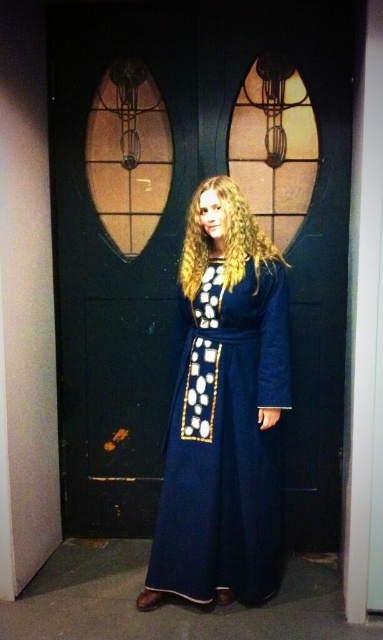
Question: Considering the real-world distances, which object is closest to the dark wood door at center?

Choices:
 (A) velvet blue robe at center
 (B) golden curly hair at center

Answer: (A)

Question: Can you confirm if dark wood door at center is smaller than velvet blue robe at center?

Choices:
 (A) yes
 (B) no

Answer: (B)

Question: Which point is closer to the camera?

Choices:
 (A) dark wood door at center
 (B) velvet blue robe at center
 (C) golden curly hair at center

Answer: (B)

Question: From the image, what is the correct spatial relationship of velvet blue robe at center in relation to golden curly hair at center?

Choices:
 (A) below
 (B) above

Answer: (A)

Question: Considering the relative positions of dark wood door at center and golden curly hair at center in the image provided, where is dark wood door at center located with respect to golden curly hair at center?

Choices:
 (A) above
 (B) below

Answer: (B)

Question: Which object is farther from the camera taking this photo?

Choices:
 (A) golden curly hair at center
 (B) dark wood door at center
 (C) velvet blue robe at center

Answer: (B)